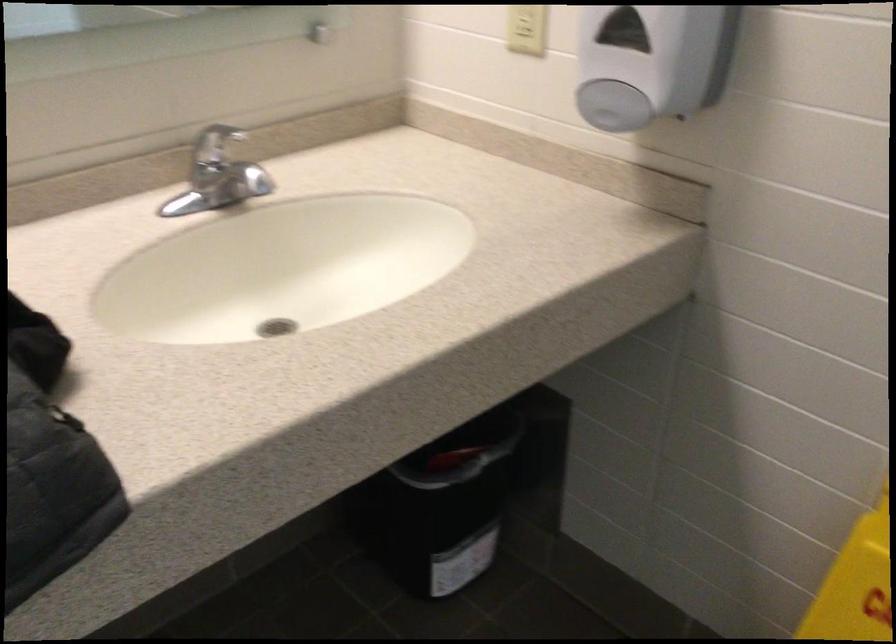
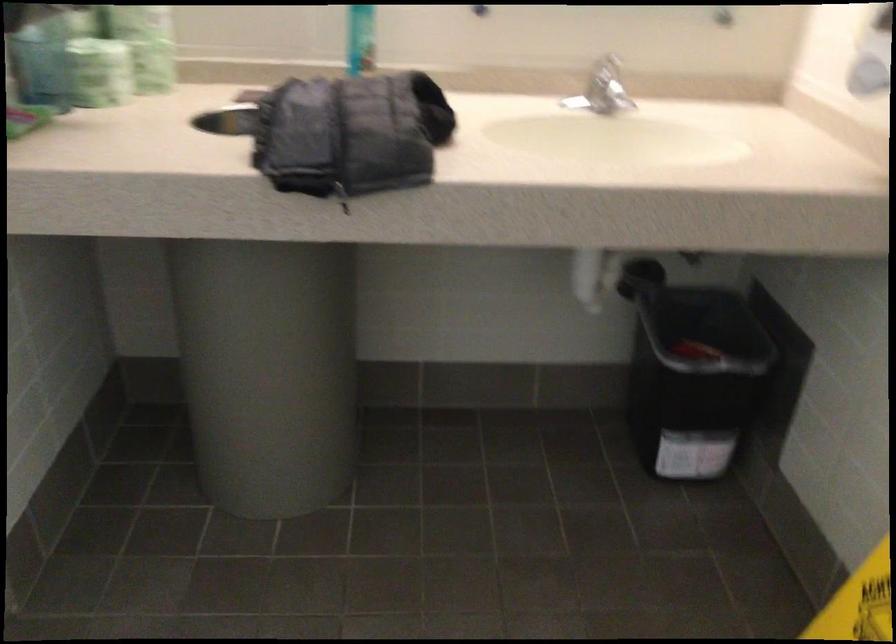
In the second image, find the point that corresponds to (455,488) in the first image.

(691, 373)